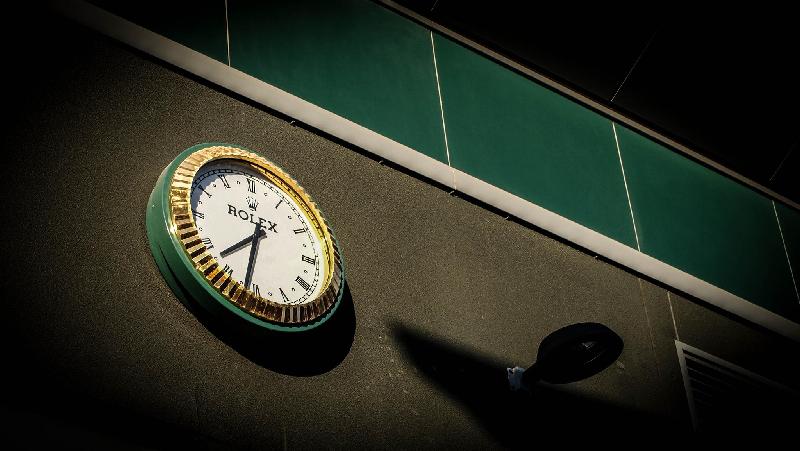
Locate an element on the screen. light is located at coordinates (594, 359).